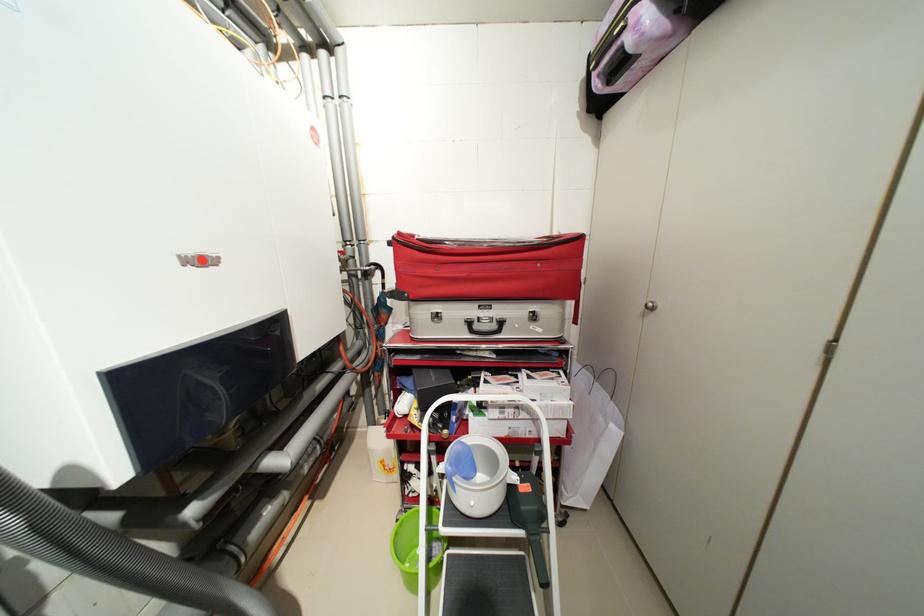
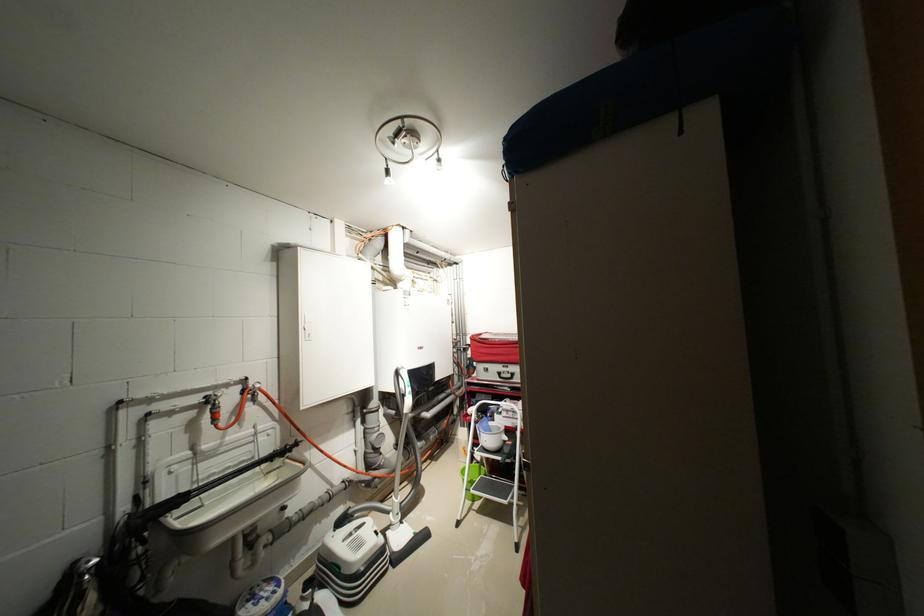
Find the pixel in the second image that matches point (508, 408) in the first image.

(515, 411)